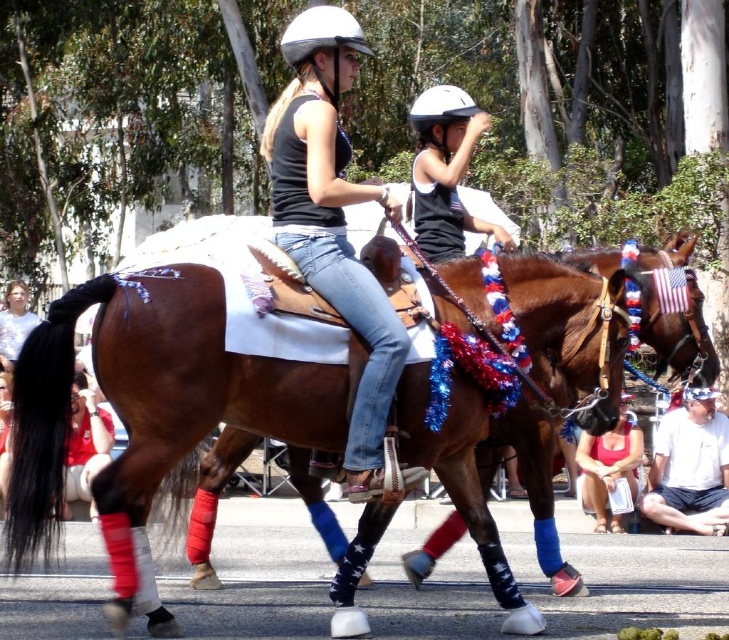
Question: Is matte black helmet at center further to camera compared to white matte helmet at center?

Choices:
 (A) yes
 (B) no

Answer: (B)

Question: Which object appears closest to the camera in this image?

Choices:
 (A) matte black helmet at center
 (B) white cotton shirt at lower right
 (C) white matte helmet at upper center
 (D) brown leather saddle at center

Answer: (D)

Question: Can you confirm if brown leather saddle at center is wider than white matte helmet at center?

Choices:
 (A) yes
 (B) no

Answer: (A)

Question: Which of these objects is positioned closest to the brown leather saddle at center?

Choices:
 (A) white matte helmet at upper center
 (B) light brown hair at center
 (C) matte black helmet at center

Answer: (C)

Question: Which object is positioned farthest from the white matte helmet at upper center?

Choices:
 (A) light brown hair at center
 (B) matte black helmet at center
 (C) matte pink tank top at lower center
 (D) brown leather saddle at center

Answer: (A)

Question: Can you confirm if brown leather saddle at center is smaller than matte pink tank top at lower center?

Choices:
 (A) no
 (B) yes

Answer: (A)